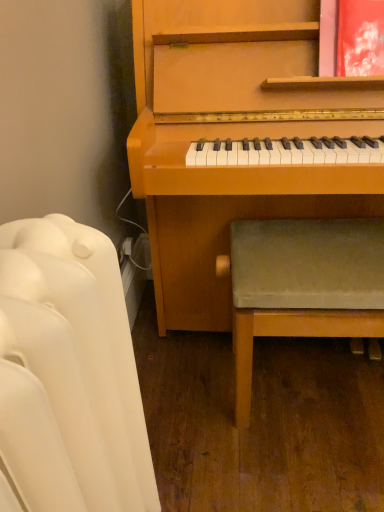
Question: Is green fabric stool at lower right positioned with its back to white tufted sofa at left?

Choices:
 (A) yes
 (B) no

Answer: (B)

Question: Is green fabric stool at lower right placed right next to white tufted sofa at left?

Choices:
 (A) yes
 (B) no

Answer: (B)

Question: From a real-world perspective, is green fabric stool at lower right beneath white tufted sofa at left?

Choices:
 (A) yes
 (B) no

Answer: (A)

Question: Is green fabric stool at lower right not near white tufted sofa at left?

Choices:
 (A) no
 (B) yes

Answer: (A)

Question: Is green fabric stool at lower right positioned before white tufted sofa at left?

Choices:
 (A) yes
 (B) no

Answer: (B)

Question: Can you confirm if green fabric stool at lower right is shorter than white tufted sofa at left?

Choices:
 (A) no
 (B) yes

Answer: (B)

Question: Is green fabric stool at lower right inside white tufted sofa at left?

Choices:
 (A) yes
 (B) no

Answer: (B)

Question: Is white tufted sofa at left at the right side of green fabric stool at lower right?

Choices:
 (A) no
 (B) yes

Answer: (A)

Question: Is green fabric stool at lower right at the back of white tufted sofa at left?

Choices:
 (A) yes
 (B) no

Answer: (B)

Question: Does white tufted sofa at left appear on the left side of green fabric stool at lower right?

Choices:
 (A) no
 (B) yes

Answer: (B)

Question: Does white tufted sofa at left have a lesser height compared to green fabric stool at lower right?

Choices:
 (A) no
 (B) yes

Answer: (A)

Question: Can you confirm if white tufted sofa at left is bigger than green fabric stool at lower right?

Choices:
 (A) yes
 (B) no

Answer: (B)

Question: Is point (64, 330) positioned closer to the camera than point (236, 234)?

Choices:
 (A) closer
 (B) farther

Answer: (A)